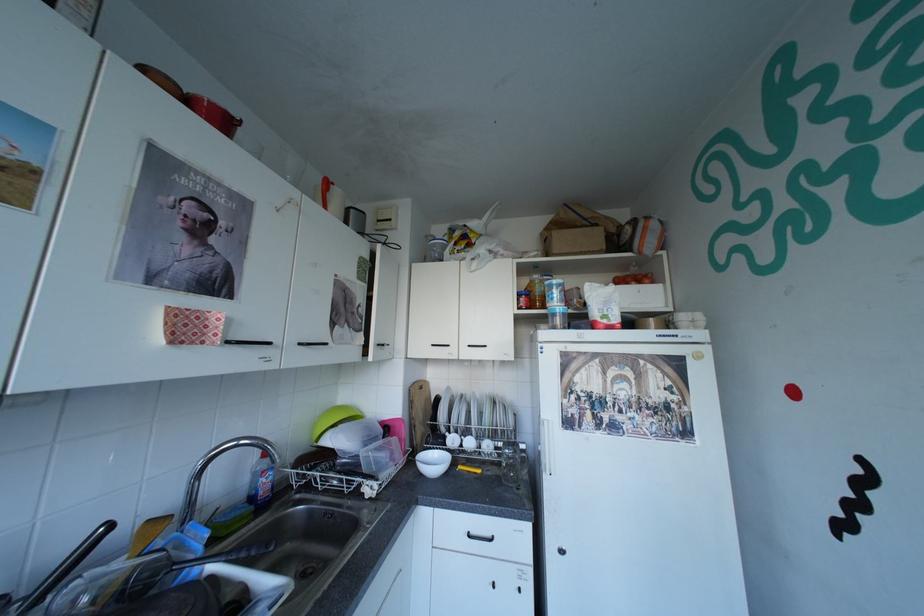
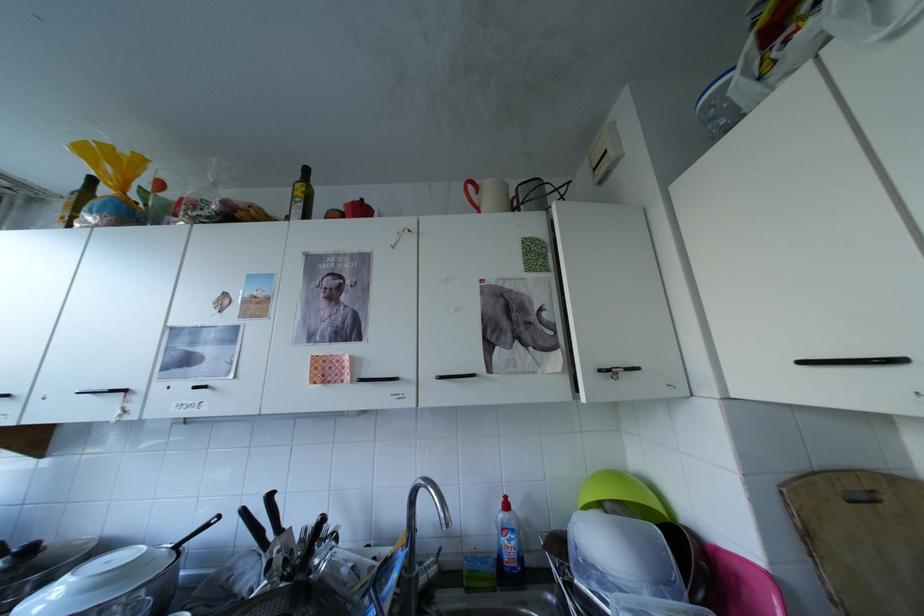
Find the pixel in the second image that matches pixel 275 480 in the first image.

(517, 541)